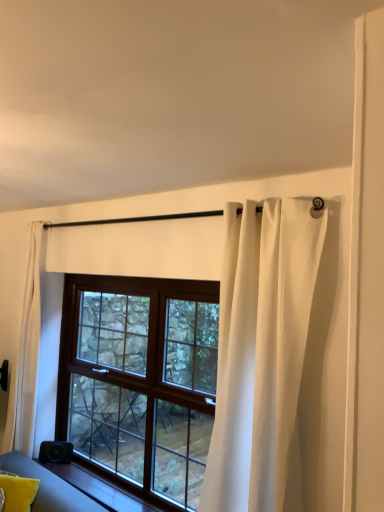
Question: Could brown wooden window at center be considered to be inside yellow fabric pillow at lower left?

Choices:
 (A) yes
 (B) no

Answer: (B)

Question: Are yellow fabric pillow at lower left and brown wooden window at center far apart?

Choices:
 (A) yes
 (B) no

Answer: (A)

Question: From a real-world perspective, is yellow fabric pillow at lower left located beneath brown wooden window at center?

Choices:
 (A) no
 (B) yes

Answer: (B)

Question: Considering the relative sizes of yellow fabric pillow at lower left and brown wooden window at center in the image provided, is yellow fabric pillow at lower left wider than brown wooden window at center?

Choices:
 (A) no
 (B) yes

Answer: (B)

Question: Would you say yellow fabric pillow at lower left is outside brown wooden window at center?

Choices:
 (A) yes
 (B) no

Answer: (A)

Question: Is yellow fabric pillow at lower left smaller than brown wooden window at center?

Choices:
 (A) yes
 (B) no

Answer: (A)

Question: Is brown wooden window at center surrounding smooth wood window sill at lower left?

Choices:
 (A) yes
 (B) no

Answer: (B)

Question: Considering the relative sizes of brown wooden window at center and smooth wood window sill at lower left in the image provided, is brown wooden window at center smaller than smooth wood window sill at lower left?

Choices:
 (A) no
 (B) yes

Answer: (A)

Question: Does brown wooden window at center have a lesser height compared to smooth wood window sill at lower left?

Choices:
 (A) yes
 (B) no

Answer: (B)

Question: Does brown wooden window at center come behind smooth wood window sill at lower left?

Choices:
 (A) yes
 (B) no

Answer: (B)

Question: Is the position of brown wooden window at center less distant than that of smooth wood window sill at lower left?

Choices:
 (A) yes
 (B) no

Answer: (A)

Question: From a real-world perspective, is brown wooden window at center on smooth wood window sill at lower left?

Choices:
 (A) yes
 (B) no

Answer: (A)

Question: Is the surface of brown wooden window at center in direct contact with white sheer curtain at left, the second curtain viewed from the right?

Choices:
 (A) no
 (B) yes

Answer: (A)